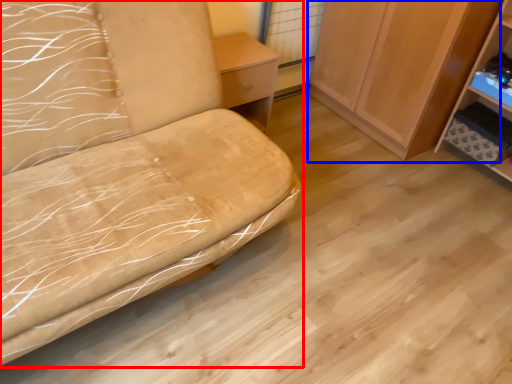
Question: Which of the following is the farthest to the observer, furniture (highlighted by a red box) or cabinetry (highlighted by a blue box)?

Choices:
 (A) furniture
 (B) cabinetry

Answer: (B)